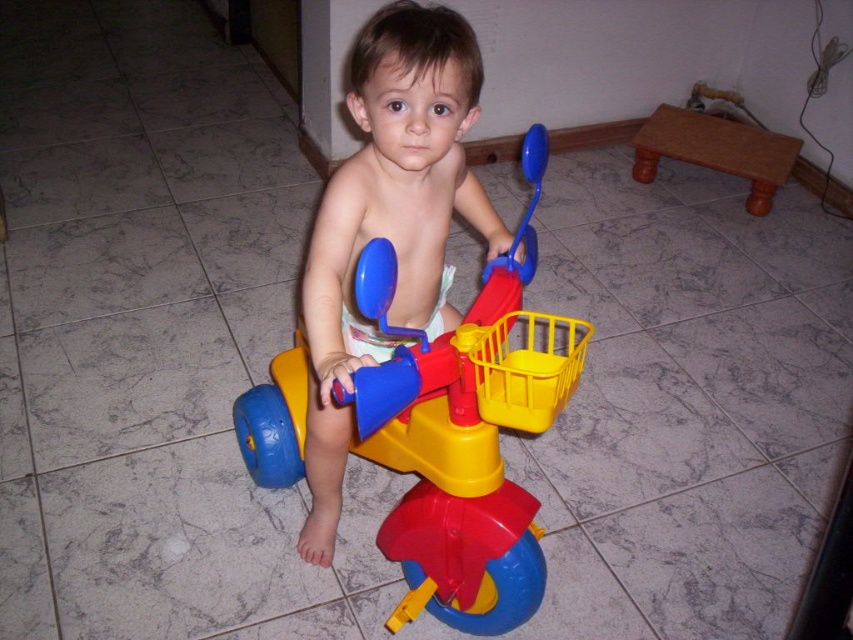
Looking at this image, you are a parent trying to clean the floor around the matte plastic tricycle at center and the matte plastic child at center. Since the child is sitting on the tricycle, which object is blocking the floor space more? Please explain.

The matte plastic tricycle at center is located below the matte plastic child at center, meaning the tricycle is closer to the floor. Since the child is sitting on the tricycle, the tricycle is the one occupying the floor space directly beneath the child, so it is blocking more floor space than the child.

You are trying to place a small toy box that measures 0.3 meters in width next to the matte plastic tricycle at center. Given the tricycle is at coordinates point 0.731, 0.528, where should you place the toy box to ensure it doesn t overlap with the tricycle?

The toy box should be placed at least 0.3 meters away from the matte plastic tricycle at center to avoid overlapping.

You are designing a playroom and need to ensure the matte plastic tricycle at center and the matte plastic child at center can fit through a doorway. The doorway is 1 meter wide. Given that the tricycle is wider than the child, can both pass through the doorway side by side?

The matte plastic tricycle at center is wider than the matte plastic child at center. Since the doorway is 1 meter wide, and the tricycle is the wider of the two, it depends on the combined width of both objects. If their total width is less than or equal to 1 meter, they can pass through side by side. However, without specific measurements, we cannot confirm for certain.